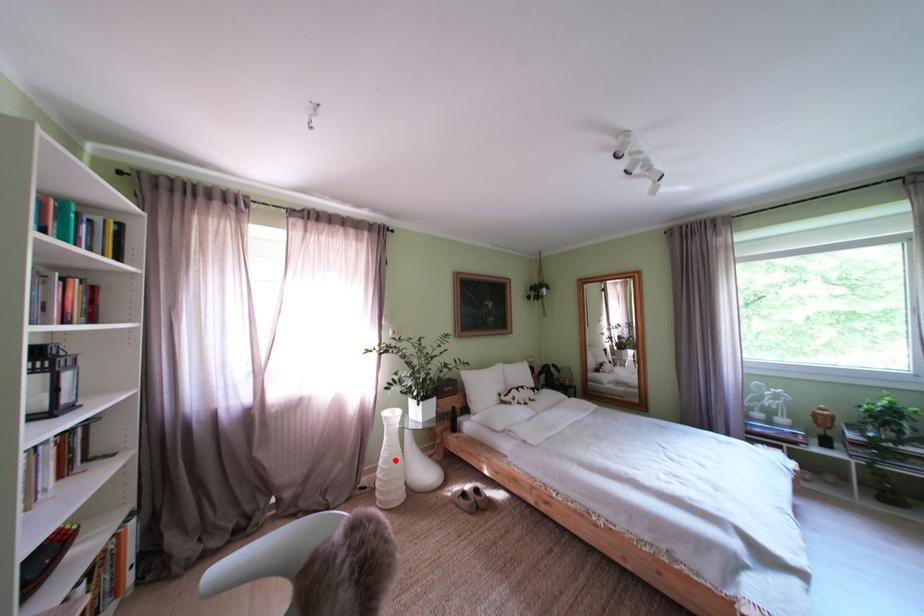
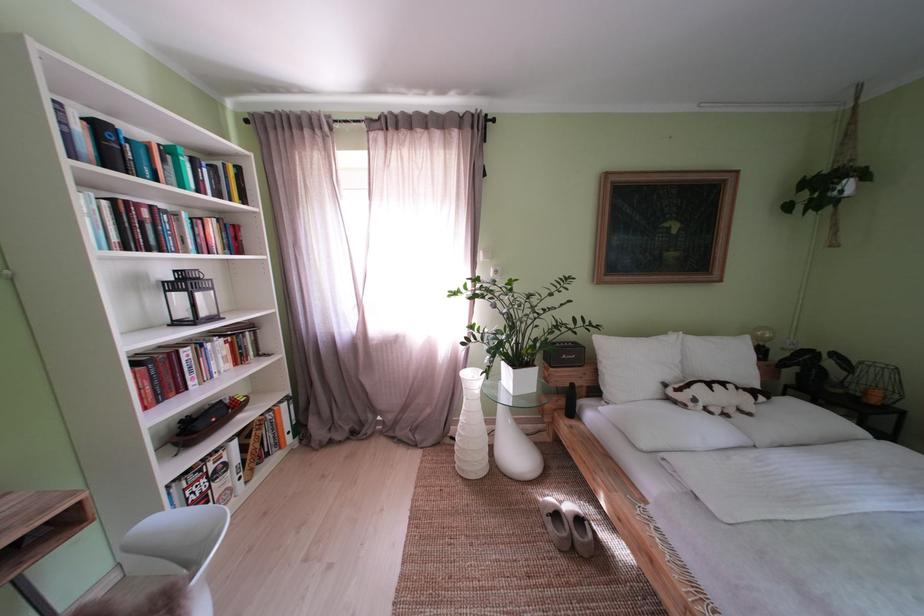
Question: I am providing you with two images of the same scene from different viewpoints. Image1 has a red point marked. In image2, the corresponding 3D location appears at what relative position? Reply with the corresponding letter.

Choices:
 (A) Closer
 (B) Farther

Answer: (B)